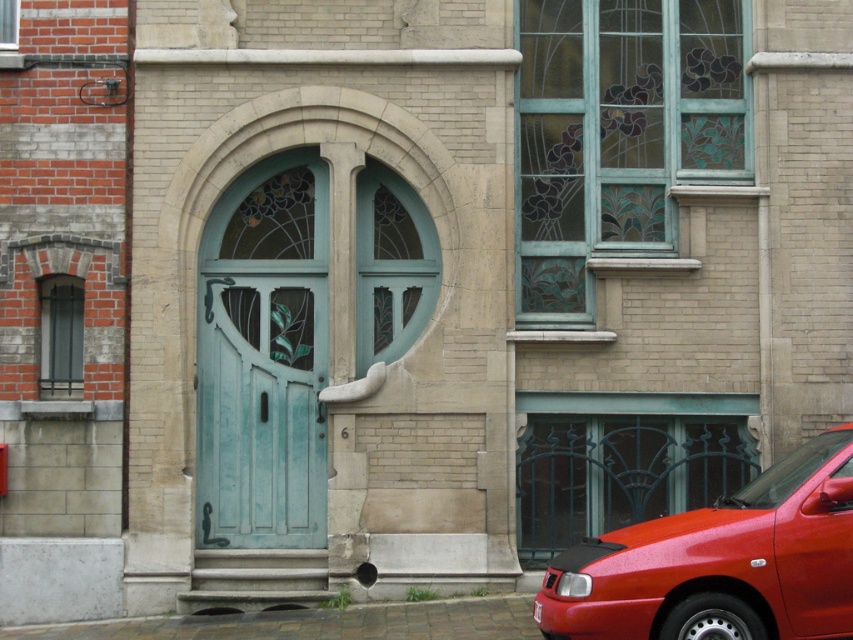
Question: Does shiny red car at lower right lie behind teal wood door at center?

Choices:
 (A) yes
 (B) no

Answer: (B)

Question: Is shiny red car at lower right bigger than teal wood door at center?

Choices:
 (A) no
 (B) yes

Answer: (B)

Question: Which object appears farthest from the camera in this image?

Choices:
 (A) teal wood door at center
 (B) shiny red car at lower right

Answer: (A)

Question: Is shiny red car at lower right behind teal wood door at center?

Choices:
 (A) no
 (B) yes

Answer: (A)

Question: Which of the following is the closest to the observer?

Choices:
 (A) teal wood door at center
 (B) shiny red car at lower right

Answer: (B)